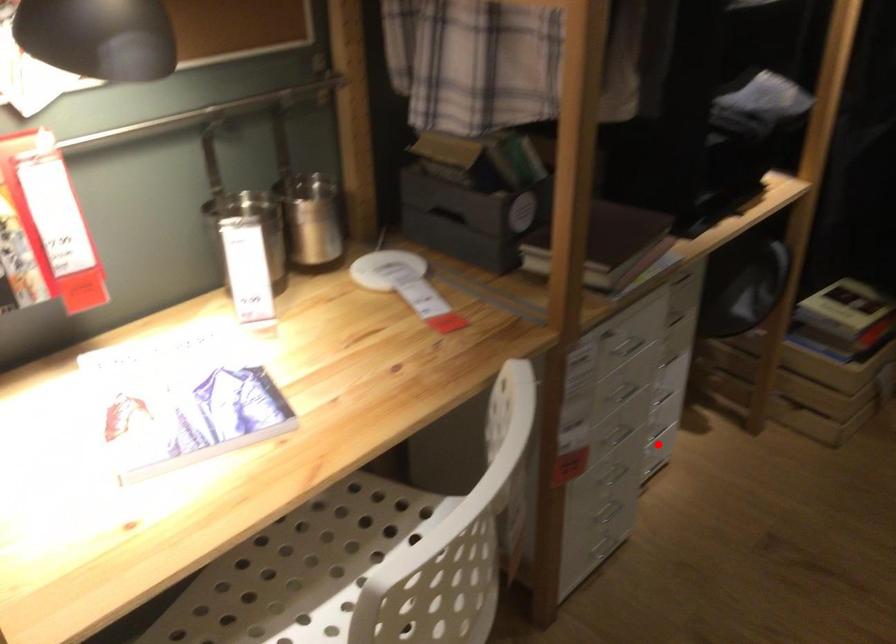
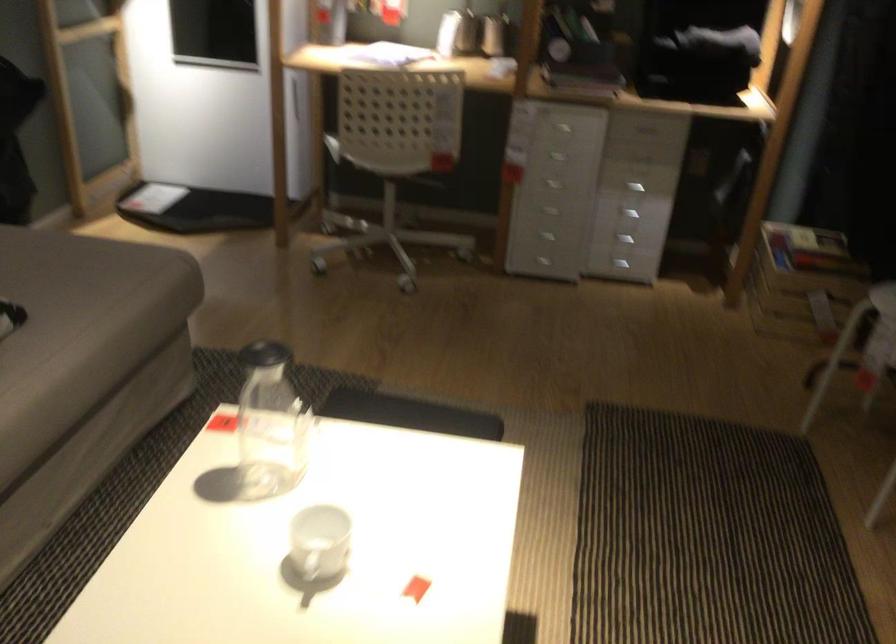
Question: I am providing you with two images of the same scene from different viewpoints. A red point is shown in image1. For the corresponding object point in image2, is it positioned nearer or farther from the camera?

Choices:
 (A) Nearer
 (B) Farther

Answer: (B)